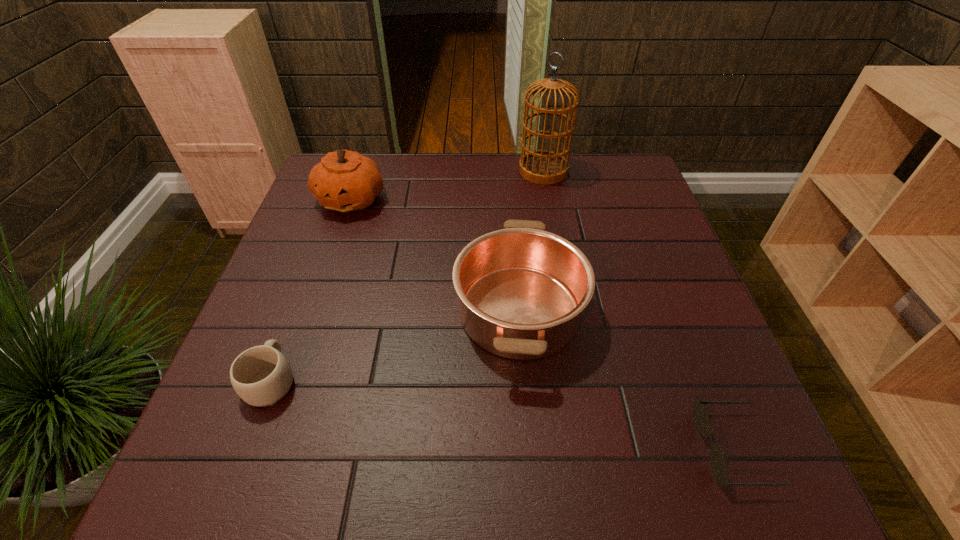
At what (x,y) coordinates should I click in order to perform the action: click on object that is at the right edge. Please return your answer as a coordinate pair (x, y). Looking at the image, I should click on (719, 466).

This screenshot has width=960, height=540. Find the location of `object at the far left corner`. object at the far left corner is located at coordinates (345, 181).

Locate an element on the screen. This screenshot has width=960, height=540. object at the near right corner is located at coordinates (719, 466).

In the image, there is a desktop. Identify the location of free space at the far edge. [x=474, y=185].

Identify the location of free space at the near edge of the desktop. The height and width of the screenshot is (540, 960). (523, 486).

Where is `vacant space at the right edge of the desktop`? The height and width of the screenshot is (540, 960). vacant space at the right edge of the desktop is located at coordinates (639, 300).

Locate an element on the screen. This screenshot has width=960, height=540. blank space at the near left corner of the desktop is located at coordinates (252, 451).

In the image, there is a desktop. Find the location of `vacant space at the far right corner`. vacant space at the far right corner is located at coordinates click(x=633, y=182).

Find the location of a particular element. The image size is (960, 540). free area in between the saucepan and the second tallest object is located at coordinates (435, 255).

The image size is (960, 540). In order to click on empty location between the tallest object and the mug in this screenshot , I will do `click(407, 275)`.